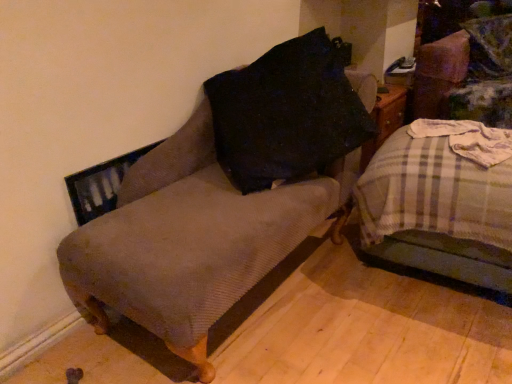
This screenshot has width=512, height=384. In order to click on free space above plaid fabric bed at right (from a real-world perspective) in this screenshot , I will do `click(456, 133)`.